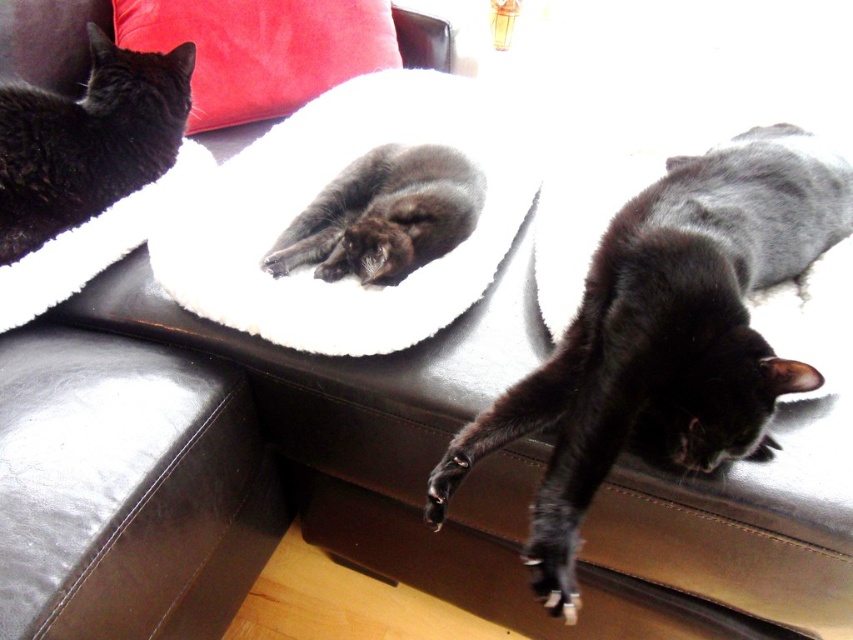
Question: Is shiny black cat at lower right bigger than velvet red pillow at upper left?

Choices:
 (A) no
 (B) yes

Answer: (B)

Question: Is shiny black cat at lower right below black soft fur cat at upper left?

Choices:
 (A) yes
 (B) no

Answer: (A)

Question: Which object is the farthest from the soft gray fur cat at center?

Choices:
 (A) black soft fur cat at upper left
 (B) white fluffy cat bed at center
 (C) velvet red pillow at upper left

Answer: (C)

Question: Which of the following is the farthest from the observer?

Choices:
 (A) (303, 116)
 (B) (677, 177)
 (C) (132, 177)
 (D) (340, 188)

Answer: (A)

Question: Is white fluffy cat bed at center below black soft fur cat at upper left?

Choices:
 (A) no
 (B) yes

Answer: (B)

Question: Considering the real-world distances, which object is closest to the shiny black cat at lower right?

Choices:
 (A) black soft fur cat at upper left
 (B) white fluffy cat bed at center
 (C) soft gray fur cat at center

Answer: (C)